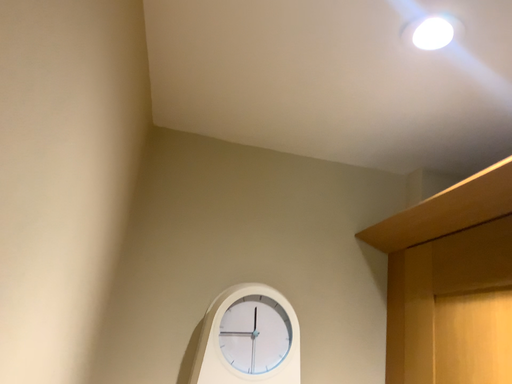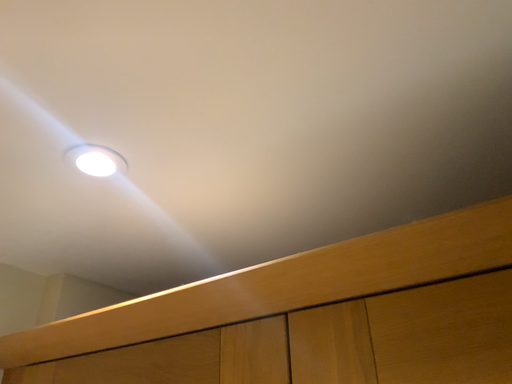
Question: How did the camera likely rotate when shooting the video?

Choices:
 (A) rotated right
 (B) rotated left

Answer: (A)